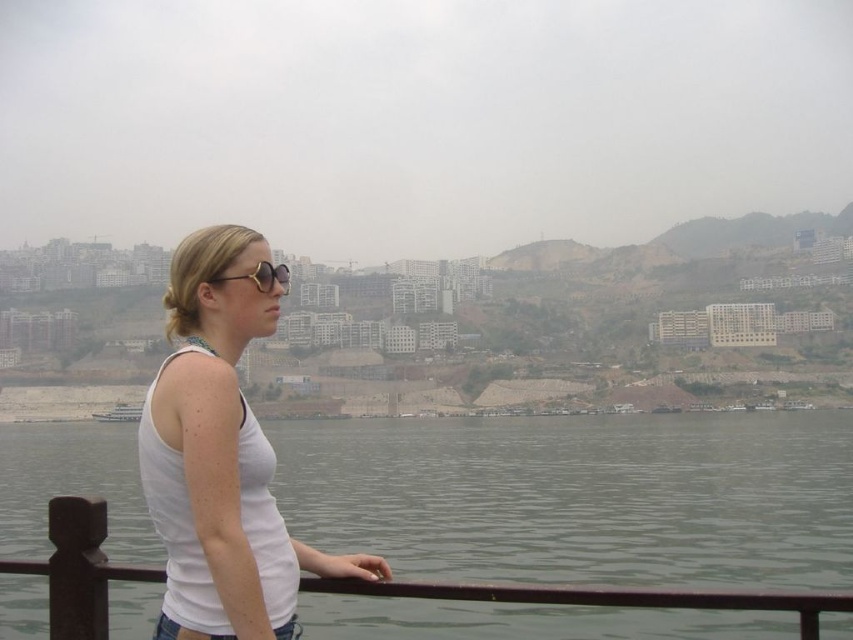
Which is above, white matte tank top at center or gold metallic sunglasses at upper center?

gold metallic sunglasses at upper center is above.

Is white matte tank top at center shorter than gold metallic sunglasses at upper center?

No, white matte tank top at center is not shorter than gold metallic sunglasses at upper center.

Who is more forward, (x=221, y=496) or (x=256, y=280)?

Point (x=221, y=496) is in front.

Identify the location of white matte tank top at center. (221, 458).

How much distance is there between white matte tank top at center and white glossy boat at lower center?

The distance of white matte tank top at center from white glossy boat at lower center is 103.80 meters.

Consider the image. Between white matte tank top at center and white glossy boat at lower center, which one is positioned higher?

white matte tank top at center

The width and height of the screenshot is (853, 640). Find the location of `white matte tank top at center`. white matte tank top at center is located at coordinates (221, 458).

At what (x,y) coordinates should I click in order to perform the action: click on white matte tank top at center. Please return your answer as a coordinate pair (x, y). Looking at the image, I should click on 221,458.

Identify the location of gold metallic sunglasses at upper center. Image resolution: width=853 pixels, height=640 pixels. (262, 276).

Does gold metallic sunglasses at upper center have a lesser height compared to white glossy boat at lower center?

Indeed, gold metallic sunglasses at upper center has a lesser height compared to white glossy boat at lower center.

Is point (260, 288) behind point (113, 413)?

No, (260, 288) is in front of (113, 413).

Where is `gold metallic sunglasses at upper center`? gold metallic sunglasses at upper center is located at coordinates (262, 276).